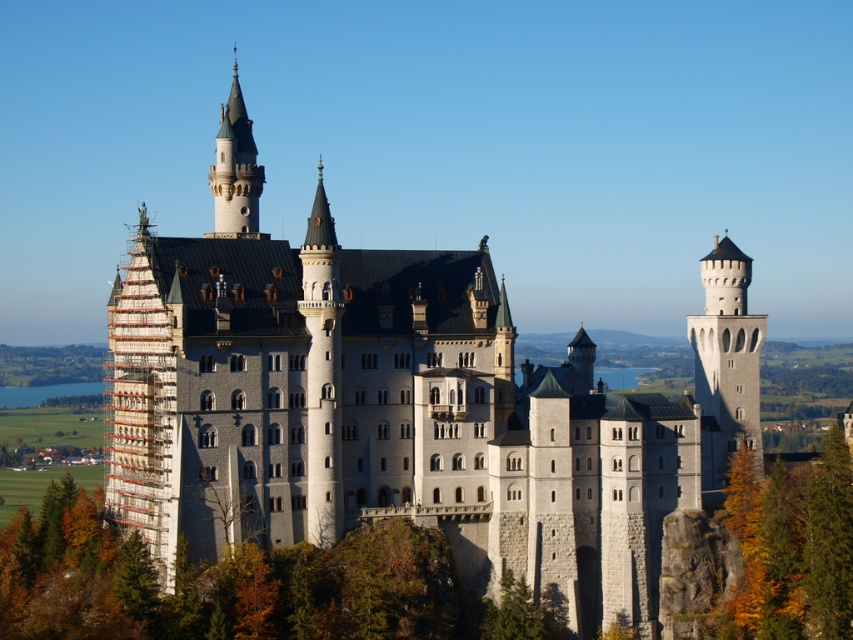
You are standing at the base of Neuschwanstein Castle and looking up at the structure. There is a point marked at coordinates (790, 548) on your view. What color are the leaves at that point?

The point at (790, 548) marks yellow green leaves at right.

What are the coordinates of the white stone castle at center in the image?

The white stone castle at center is located at coordinates point (407,413).